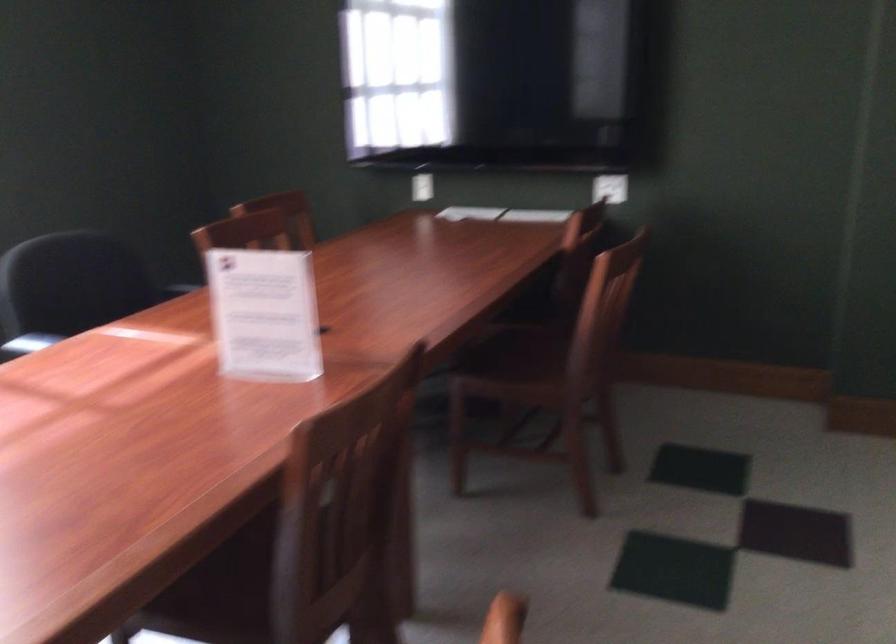
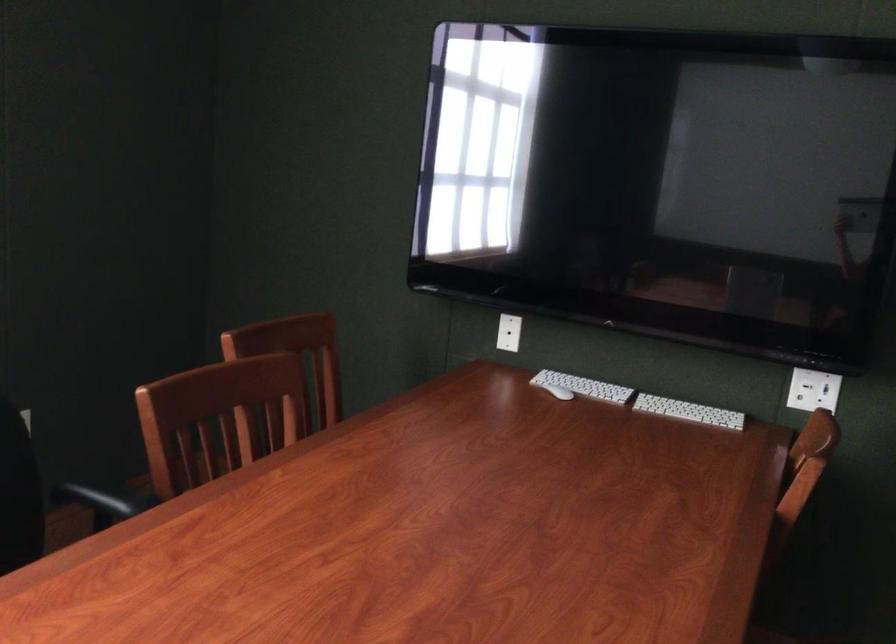
The point at (419,184) is marked in the first image. Where is the corresponding point in the second image?

(509, 333)